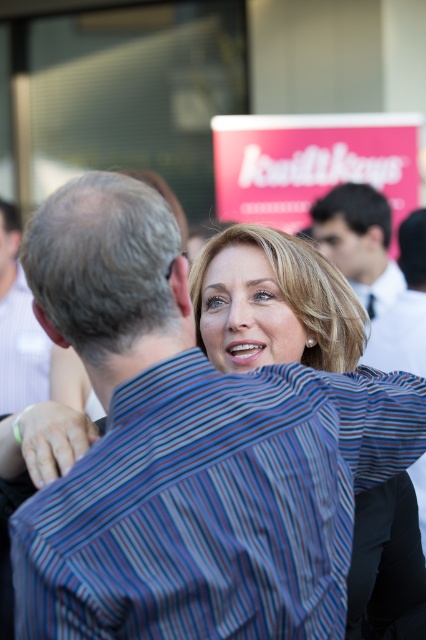
Can you confirm if striped shirt at center is taller than striped shirt at left?

No.

This screenshot has width=426, height=640. Describe the element at coordinates (386, 564) in the screenshot. I see `striped shirt at center` at that location.

Between point (344, 211) and point (34, 340), which one is positioned behind?

The point (34, 340) is more distant.

I want to click on striped shirt at center, so click(386, 564).

Is striped shirt at center thinner than dark blue shirt at upper right?

Yes, striped shirt at center is thinner than dark blue shirt at upper right.

Between striped shirt at center and dark blue shirt at upper right, which one has more height?

With more height is dark blue shirt at upper right.

Locate an element on the screen. striped shirt at center is located at coordinates (386, 564).

Is striped cotton shirt at center positioned behind striped shirt at left?

That is False.

Can you confirm if striped cotton shirt at center is thinner than striped shirt at left?

No, striped cotton shirt at center is not thinner than striped shirt at left.

Between point (209, 493) and point (8, 365), which one is positioned in front?

Positioned in front is point (209, 493).

You are a GUI agent. You are given a task and a screenshot of the screen. Output one action in this format:
    pyautogui.click(x=<x>, y=<y>)
    Task: Click on the striped cotton shirt at center
    This screenshot has width=426, height=640.
    Given the screenshot: What is the action you would take?
    pyautogui.click(x=213, y=504)